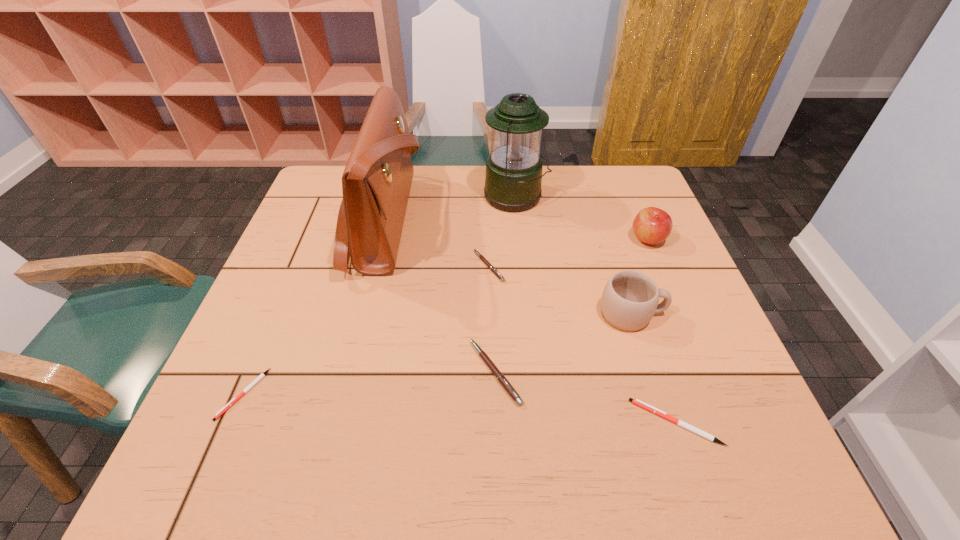
At what (x,y) coordinates should I click in order to perform the action: click on vacant space positioned 0.080m at the nib of the smaller pink pen. Please return your answer as a coordinate pair (x, y). Looking at the image, I should click on (442, 266).

Identify the location of free region located 0.140m at the nib of the smaller pink pen. (418, 266).

Where is `free location located 0.240m on the clicker of the right white pen`? This screenshot has width=960, height=540. free location located 0.240m on the clicker of the right white pen is located at coordinates (504, 422).

Image resolution: width=960 pixels, height=540 pixels. Find the location of `vacant area located on the clicker of the right white pen`. vacant area located on the clicker of the right white pen is located at coordinates (595, 422).

Where is `vacant space located on the clicker of the right white pen`? This screenshot has height=540, width=960. vacant space located on the clicker of the right white pen is located at coordinates (466, 422).

The width and height of the screenshot is (960, 540). I want to click on free space located 0.110m on the clicker of the leftmost pen, so click(205, 484).

Locate an element on the screen. The width and height of the screenshot is (960, 540). satchel present at the far edge is located at coordinates (376, 182).

Identify the location of lantern that is at the far edge. (513, 178).

You are a GUI agent. You are given a task and a screenshot of the screen. Output one action in this format:
    pyautogui.click(x=<x>, y=<y>)
    Task: Click on the object that is at the near edge
    Image resolution: width=960 pixels, height=540 pixels.
    Given the screenshot: What is the action you would take?
    637,402

I want to click on satchel at the left edge, so click(376, 182).